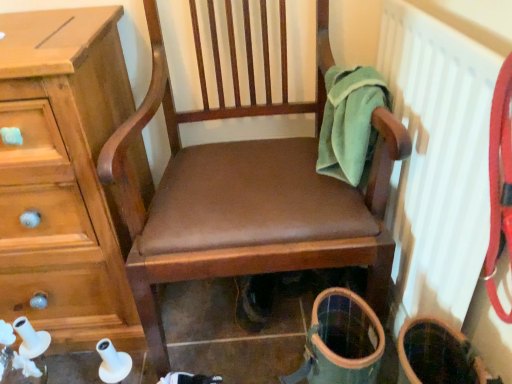
The image size is (512, 384). What do you see at coordinates (350, 123) in the screenshot? I see `green fleece towel at upper right` at bounding box center [350, 123].

This screenshot has width=512, height=384. Describe the element at coordinates (244, 190) in the screenshot. I see `brown leather chair at center` at that location.

This screenshot has height=384, width=512. Identify the location of green fleece towel at upper right. (350, 123).

From the image's perspective, who appears lower, wooden chest of drawers at left or brown leather chair at center?

wooden chest of drawers at left is shown below in the image.

Based on the photo, would you say wooden chest of drawers at left is to the left or to the right of brown leather chair at center in the picture?

wooden chest of drawers at left is to the left of brown leather chair at center.

In terms of height, does wooden chest of drawers at left look taller or shorter compared to brown leather chair at center?

wooden chest of drawers at left is shorter than brown leather chair at center.

Consider the image. Which of these two, wooden chest of drawers at left or brown leather chair at center, is wider?

brown leather chair at center is wider.

Is white textured radiator at upper right to the left of green fleece towel at upper right from the viewer's perspective?

No, white textured radiator at upper right is not to the left of green fleece towel at upper right.

Is white textured radiator at upper right spatially inside green fleece towel at upper right, or outside of it?

white textured radiator at upper right is spatially situated outside green fleece towel at upper right.

Is green fleece towel at upper right at the back of white textured radiator at upper right?

That's right, white textured radiator at upper right is facing away from green fleece towel at upper right.

In the image, is white textured radiator at upper right on the left side or the right side of wooden chest of drawers at left?

Based on their positions, white textured radiator at upper right is located to the right of wooden chest of drawers at left.

Is white textured radiator at upper right facing away from wooden chest of drawers at left?

No, white textured radiator at upper right is not facing away from wooden chest of drawers at left.

From a real-world perspective, who is located higher, white textured radiator at upper right or wooden chest of drawers at left?

From a 3D spatial view, white textured radiator at upper right is above.

Which object is wider, white textured radiator at upper right or wooden chest of drawers at left?

With larger width is wooden chest of drawers at left.

From the picture: Is wooden chest of drawers at left aimed at green fleece towel at upper right?

No, wooden chest of drawers at left is not turned towards green fleece towel at upper right.

Is the depth of wooden chest of drawers at left less than that of green fleece towel at upper right?

Yes, wooden chest of drawers at left is closer to the camera.

From the image's perspective, is wooden chest of drawers at left over green fleece towel at upper right?

Actually, wooden chest of drawers at left appears below green fleece towel at upper right in the image.

Which object is further away from the camera, brown leather chair at center or green fleece towel at upper right?

green fleece towel at upper right is further away from the camera.

Consider the image. Is brown leather chair at center thinner than green fleece towel at upper right?

Incorrect, the width of brown leather chair at center is not less than that of green fleece towel at upper right.

How different are the orientations of brown leather chair at center and green fleece towel at upper right in degrees?

There is a 0.000766-degree angle between the facing directions of brown leather chair at center and green fleece towel at upper right.

Between brown leather chair at center and green fleece towel at upper right, which one has smaller size?

green fleece towel at upper right is smaller.

Relative to wooden chest of drawers at left, is green fleece towel at upper right in front or behind?

Clearly, green fleece towel at upper right is behind wooden chest of drawers at left.

From the image's perspective, is green fleece towel at upper right above or below wooden chest of drawers at left?

From the image's perspective, green fleece towel at upper right appears above wooden chest of drawers at left.

Which is more to the right, green fleece towel at upper right or wooden chest of drawers at left?

green fleece towel at upper right.

The width and height of the screenshot is (512, 384). I want to click on chair lying above the wooden chest of drawers at left (from the image's perspective), so [244, 190].

From a real-world perspective, which object stands above the other?

brown leather chair at center, from a real-world perspective.

Between brown leather chair at center and wooden chest of drawers at left, which one has more height?

brown leather chair at center is taller.

Which point is more distant from viewer, (199, 251) or (70, 206)?

The point (70, 206) is behind.

I want to click on the chest of drawers located below the brown leather chair at center (from the image's perspective), so click(x=64, y=176).

Locate an element on the screen. This screenshot has width=512, height=384. clothing that appears above the white textured radiator at upper right (from a real-world perspective) is located at coordinates (350, 123).

From the image, which object appears to be nearer to brown leather chair at center, green fleece towel at upper right or white textured radiator at upper right?

green fleece towel at upper right lies closer to brown leather chair at center than the other object.

Estimate the real-world distances between objects in this image. Which object is further from green fleece towel at upper right, wooden chest of drawers at left or brown leather chair at center?

The object further to green fleece towel at upper right is wooden chest of drawers at left.

Considering their positions, is brown leather chair at center positioned closer to white textured radiator at upper right than wooden chest of drawers at left?

brown leather chair at center is closer to white textured radiator at upper right.

Considering their positions, is white textured radiator at upper right positioned closer to brown leather chair at center than green fleece towel at upper right?

green fleece towel at upper right.

Which object lies further to the anchor point wooden chest of drawers at left, brown leather chair at center or green fleece towel at upper right?

Among the two, green fleece towel at upper right is located further to wooden chest of drawers at left.

Considering their positions, is green fleece towel at upper right positioned closer to white textured radiator at upper right than brown leather chair at center?

The object closer to white textured radiator at upper right is green fleece towel at upper right.

When comparing their distances from brown leather chair at center, does wooden chest of drawers at left or green fleece towel at upper right seem closer?

green fleece towel at upper right lies closer to brown leather chair at center than the other object.

Based on the photo, estimate the real-world distances between objects in this image. Which object is closer to brown leather chair at center, wooden chest of drawers at left or white textured radiator at upper right?

wooden chest of drawers at left is closer to brown leather chair at center.

This screenshot has width=512, height=384. What are the coordinates of `chair located between wooden chest of drawers at left and green fleece towel at upper right in the left-right direction` in the screenshot? It's located at (244, 190).

This screenshot has width=512, height=384. Identify the location of chair positioned between white textured radiator at upper right and green fleece towel at upper right from near to far. (244, 190).

The image size is (512, 384). What are the coordinates of `clothing between wooden chest of drawers at left and white textured radiator at upper right` in the screenshot? It's located at point(350,123).

Locate an element on the screen. The width and height of the screenshot is (512, 384). chair between wooden chest of drawers at left and white textured radiator at upper right from left to right is located at coordinates pos(244,190).